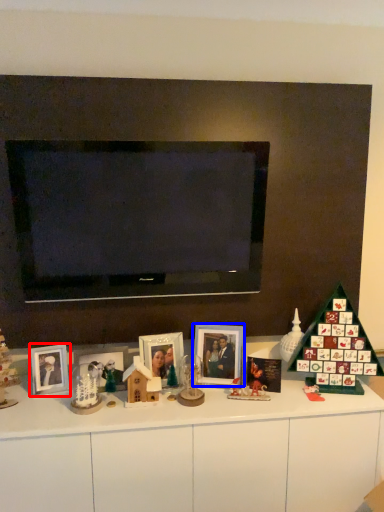
Question: Among these objects, which one is nearest to the camera, picture frame (highlighted by a red box) or picture frame (highlighted by a blue box)?

Choices:
 (A) picture frame
 (B) picture frame

Answer: (A)